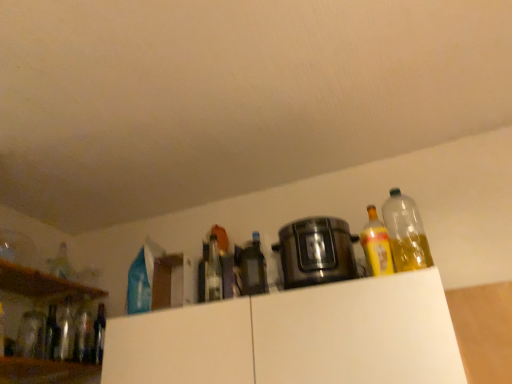
Identify the location of vacant area situated to the left side of clear glass bottle at left, the 5th bottle positioned from the left. This screenshot has width=512, height=384. pyautogui.click(x=54, y=361).